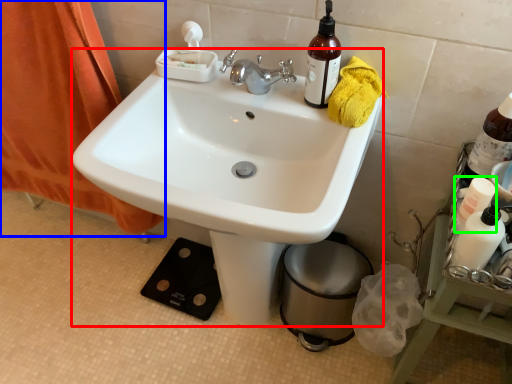
Question: Based on their relative distances, which object is nearer to sink (highlighted by a red box)? Choose from curtain (highlighted by a blue box) and bottle (highlighted by a green box).

Choices:
 (A) curtain
 (B) bottle

Answer: (A)